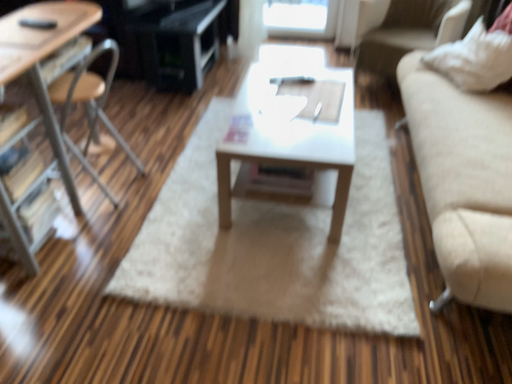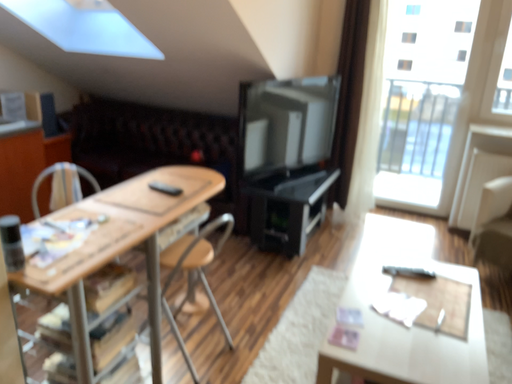
Question: Which way did the camera rotate in the video?

Choices:
 (A) rotated downward
 (B) rotated upward

Answer: (B)